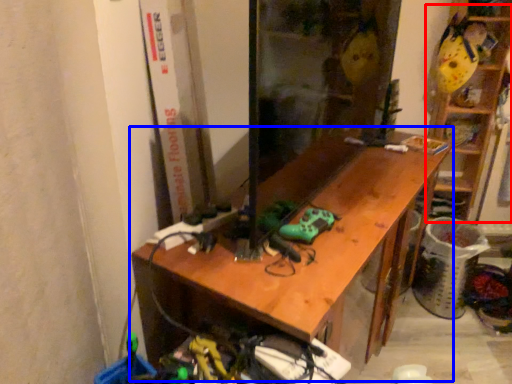
Question: Which point is further to the camera, shelf (highlighted by a red box) or desk (highlighted by a blue box)?

Choices:
 (A) shelf
 (B) desk

Answer: (A)